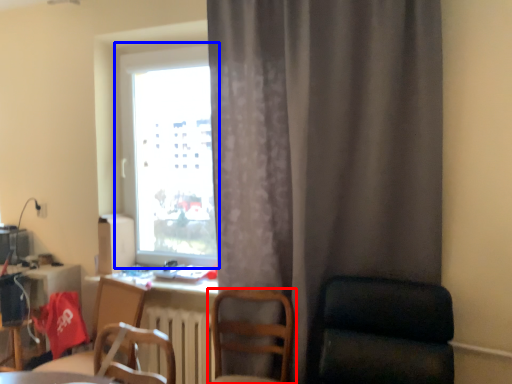
Question: Which point is closer to the camera, chair (highlighted by a red box) or window (highlighted by a blue box)?

Choices:
 (A) chair
 (B) window

Answer: (A)